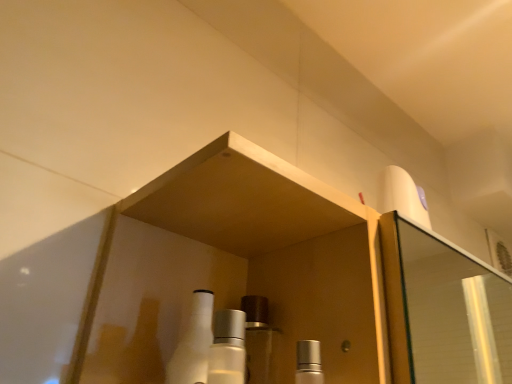
Question: Which direction should I rotate to face satin silver bottle at center, the first mouthwash in the left-to-right sequence, — up or down?

Choices:
 (A) up
 (B) down

Answer: (B)

Question: Can you confirm if satin silver cap at center, positioned as the 2th mouthwash in left-to-right order, is positioned to the right of satin silver bottle at center, the first mouthwash in the left-to-right sequence?

Choices:
 (A) no
 (B) yes

Answer: (B)

Question: Is satin silver cap at center, which is the 1th mouthwash in right-to-left order, with satin silver bottle at center, the 2th mouthwash from the right?

Choices:
 (A) yes
 (B) no

Answer: (A)

Question: Is satin silver cap at center, which is the 1th mouthwash in right-to-left order, bigger than satin silver bottle at center, the first mouthwash in the left-to-right sequence?

Choices:
 (A) yes
 (B) no

Answer: (A)

Question: Is satin silver cap at center, positioned as the 2th mouthwash in left-to-right order, thinner than satin silver bottle at center, the first mouthwash in the left-to-right sequence?

Choices:
 (A) yes
 (B) no

Answer: (B)

Question: From a real-world perspective, is satin silver cap at center, positioned as the 2th mouthwash in left-to-right order, below satin silver bottle at center, the 2th mouthwash from the right?

Choices:
 (A) no
 (B) yes

Answer: (B)

Question: From the image's perspective, would you say satin silver cap at center, which is the 1th mouthwash in right-to-left order, is positioned over satin silver bottle at center, the 2th mouthwash from the right?

Choices:
 (A) no
 (B) yes

Answer: (A)

Question: Is satin silver bottle at center, the first mouthwash in the left-to-right sequence, oriented away from white glossy bottle at center?

Choices:
 (A) no
 (B) yes

Answer: (B)

Question: Can you confirm if satin silver bottle at center, the 2th mouthwash from the right, is taller than white glossy bottle at center?

Choices:
 (A) no
 (B) yes

Answer: (A)

Question: Is satin silver bottle at center, the first mouthwash in the left-to-right sequence, positioned before white glossy bottle at center?

Choices:
 (A) yes
 (B) no

Answer: (A)

Question: Can white glossy bottle at center be found inside satin silver bottle at center, the first mouthwash in the left-to-right sequence?

Choices:
 (A) no
 (B) yes

Answer: (A)

Question: Is satin silver bottle at center, the first mouthwash in the left-to-right sequence, bigger than white glossy bottle at center?

Choices:
 (A) yes
 (B) no

Answer: (B)

Question: Considering the relative sizes of satin silver bottle at center, the first mouthwash in the left-to-right sequence, and white glossy bottle at center in the image provided, is satin silver bottle at center, the first mouthwash in the left-to-right sequence, thinner than white glossy bottle at center?

Choices:
 (A) yes
 (B) no

Answer: (A)

Question: Can you confirm if white glossy bottle at center is taller than satin silver cap at center, positioned as the 2th mouthwash in left-to-right order?

Choices:
 (A) yes
 (B) no

Answer: (A)